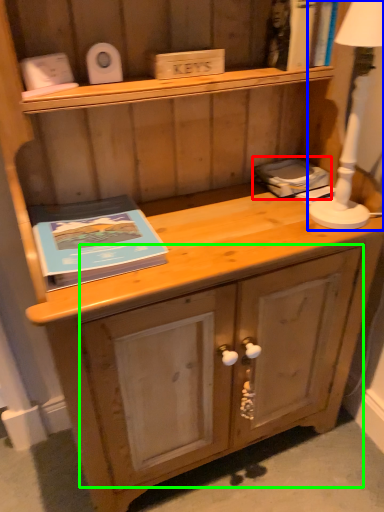
Question: Which object is positioned farthest from book (highlighted by a red box)? Select from bedside lamp (highlighted by a blue box) and drawer (highlighted by a green box).

Choices:
 (A) bedside lamp
 (B) drawer

Answer: (B)